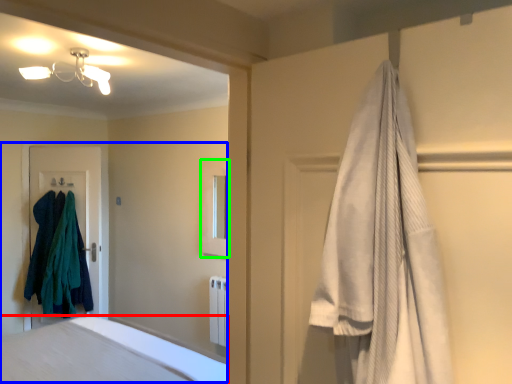
Question: Estimate the real-world distances between objects in this image. Which object is farther from bathtub (highlighted by a red box), bed (highlighted by a blue box) or medicine cabinet (highlighted by a green box)?

Choices:
 (A) bed
 (B) medicine cabinet

Answer: (A)